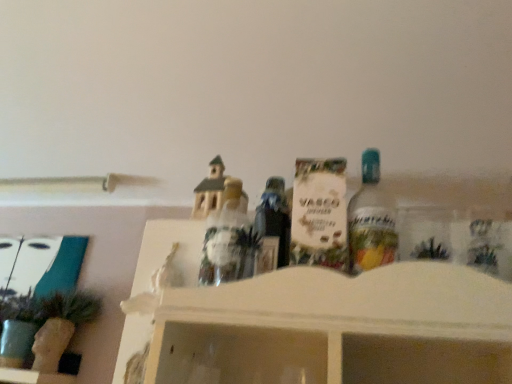
The image size is (512, 384). What do you see at coordinates (319, 214) in the screenshot?
I see `white matte box at center, placed as the third toy when sorted from left to right` at bounding box center [319, 214].

Identify the location of matte brown house at center, the second toy positioned from the left. (227, 239).

Identify the location of bottle on the right of matte brown house at center, the second toy positioned from the left. (371, 220).

Can you tell me how much clear glass bottle at center-right and matte brown house at center, the 2th toy positioned from the right, differ in facing direction?

A: They differ by 0.000237 degrees in their facing directions.

Which of these two, clear glass bottle at center-right or matte brown house at center, the second toy positioned from the left, stands taller?

With more height is clear glass bottle at center-right.

Which is correct: clear glass bottle at center-right is inside matte brown house at center, the 2th toy positioned from the right, or outside of it?

The correct answer is: outside.

Which is closer, (374, 160) or (132, 376)?

The point (374, 160) is more forward.

Considering the relative sizes of clear glass bottle at center-right and translucent plastic figurine at center, the first toy positioned from the left, in the image provided, is clear glass bottle at center-right bigger than translucent plastic figurine at center, the first toy positioned from the left,?

No.

From the image's perspective, is clear glass bottle at center-right below translucent plastic figurine at center, the third toy from the right?

Incorrect, from the image's perspective, clear glass bottle at center-right is higher than translucent plastic figurine at center, the third toy from the right.

Are clear glass bottle at center-right and translucent plastic figurine at center, the first toy positioned from the left, located far from each other?

clear glass bottle at center-right is actually quite close to translucent plastic figurine at center, the first toy positioned from the left.

The height and width of the screenshot is (384, 512). There is a translucent plastic figurine at center, the third toy from the right. What are the coordinates of `the 1st toy above it (from the image's perspective)` in the screenshot? It's located at (227, 239).

Considering the sizes of objects matte brown house at center, the second toy positioned from the left, and translucent plastic figurine at center, the first toy positioned from the left, in the image provided, who is smaller, matte brown house at center, the second toy positioned from the left, or translucent plastic figurine at center, the first toy positioned from the left,?

matte brown house at center, the second toy positioned from the left, is smaller.

Looking at this image, how much distance is there between matte brown house at center, the 2th toy positioned from the right, and translucent plastic figurine at center, the first toy positioned from the left?

A distance of 11.46 centimeters exists between matte brown house at center, the 2th toy positioned from the right, and translucent plastic figurine at center, the first toy positioned from the left.

Which is in front, point (213, 265) or point (135, 373)?

Positioned in front is point (213, 265).

From the picture: Is the surface of translucent plastic figurine at center, the first toy positioned from the left, in direct contact with white matte box at center, placed as the third toy when sorted from left to right?

No, translucent plastic figurine at center, the first toy positioned from the left, is not making contact with white matte box at center, placed as the third toy when sorted from left to right.

Considering the relative positions of translucent plastic figurine at center, the first toy positioned from the left, and white matte box at center, placed as the third toy when sorted from left to right, in the image provided, is translucent plastic figurine at center, the first toy positioned from the left, to the left of white matte box at center, placed as the third toy when sorted from left to right, from the viewer's perspective?

Indeed, translucent plastic figurine at center, the first toy positioned from the left, is positioned on the left side of white matte box at center, placed as the third toy when sorted from left to right.

Is translucent plastic figurine at center, the first toy positioned from the left, in front of white matte box at center, arranged as the first toy when viewed from the right?

No, it is not.

From a real-world perspective, is translucent plastic figurine at center, the first toy positioned from the left, on matte brown house at center, the second toy positioned from the left?

Actually, translucent plastic figurine at center, the first toy positioned from the left, is physically below matte brown house at center, the second toy positioned from the left, in the real world.

Does translucent plastic figurine at center, the third toy from the right, have a lesser width compared to matte brown house at center, the 2th toy positioned from the right?

Correct, the width of translucent plastic figurine at center, the third toy from the right, is less than that of matte brown house at center, the 2th toy positioned from the right.

Does translucent plastic figurine at center, the third toy from the right, come in front of matte brown house at center, the second toy positioned from the left?

Yes, the depth of translucent plastic figurine at center, the third toy from the right, is less than that of matte brown house at center, the second toy positioned from the left.

In the scene shown: From the image's perspective, relative to matte brown house at center, the second toy positioned from the left, is translucent plastic figurine at center, the first toy positioned from the left, above or below?

translucent plastic figurine at center, the first toy positioned from the left, is below matte brown house at center, the second toy positioned from the left.

Considering the sizes of white matte box at center, arranged as the first toy when viewed from the right, and translucent plastic figurine at center, the first toy positioned from the left, in the image, is white matte box at center, arranged as the first toy when viewed from the right, wider or thinner than translucent plastic figurine at center, the first toy positioned from the left,?

Considering their sizes, white matte box at center, arranged as the first toy when viewed from the right, looks broader than translucent plastic figurine at center, the first toy positioned from the left.

From a real-world perspective, is white matte box at center, arranged as the first toy when viewed from the right, positioned under translucent plastic figurine at center, the first toy positioned from the left, based on gravity?

Actually, white matte box at center, arranged as the first toy when viewed from the right, is physically above translucent plastic figurine at center, the first toy positioned from the left, in the real world.

Is white matte box at center, placed as the third toy when sorted from left to right, at the right side of translucent plastic figurine at center, the first toy positioned from the left?

Indeed, white matte box at center, placed as the third toy when sorted from left to right, is positioned on the right side of translucent plastic figurine at center, the first toy positioned from the left.

Are white matte box at center, arranged as the first toy when viewed from the right, and clear glass bottle at center-right making contact?

Absolutely, white matte box at center, arranged as the first toy when viewed from the right, is next to and touching clear glass bottle at center-right.

Which object is positioned more to the right, white matte box at center, placed as the third toy when sorted from left to right, or clear glass bottle at center-right?

From the viewer's perspective, clear glass bottle at center-right appears more on the right side.

Which point is more distant from viewer, [330,185] or [355,248]?

The point [330,185] is behind.

Where is `the 3rd toy behind when counting from the clear glass bottle at center-right`? This screenshot has height=384, width=512. the 3rd toy behind when counting from the clear glass bottle at center-right is located at coordinates (227, 239).

Image resolution: width=512 pixels, height=384 pixels. I want to click on the 3rd toy below the clear glass bottle at center-right (from the image's perspective), so click(x=149, y=312).

From the picture: Which object lies further to the anchor point clear glass bottle at center-right, matte brown house at center, the 2th toy positioned from the right, or white matte box at center, placed as the third toy when sorted from left to right?

matte brown house at center, the 2th toy positioned from the right, is further to clear glass bottle at center-right.

Considering their positions, is white matte box at center, placed as the third toy when sorted from left to right, positioned closer to matte brown house at center, the 2th toy positioned from the right, than clear glass bottle at center-right?

Among the two, white matte box at center, placed as the third toy when sorted from left to right, is located nearer to matte brown house at center, the 2th toy positioned from the right.

Looking at the image, which one is located closer to matte brown house at center, the 2th toy positioned from the right, clear glass bottle at center-right or translucent plastic figurine at center, the first toy positioned from the left?

Based on the image, translucent plastic figurine at center, the first toy positioned from the left, appears to be nearer to matte brown house at center, the 2th toy positioned from the right.

Estimate the real-world distances between objects in this image. Which object is closer to translucent plastic figurine at center, the third toy from the right, clear glass bottle at center-right or white matte box at center, arranged as the first toy when viewed from the right?

white matte box at center, arranged as the first toy when viewed from the right, is positioned closer to the anchor translucent plastic figurine at center, the third toy from the right.

From the image, which object appears to be farther from white matte box at center, arranged as the first toy when viewed from the right, clear glass bottle at center-right or translucent plastic figurine at center, the first toy positioned from the left?

Among the two, translucent plastic figurine at center, the first toy positioned from the left, is located further to white matte box at center, arranged as the first toy when viewed from the right.

When comparing their distances from translucent plastic figurine at center, the first toy positioned from the left, does matte brown house at center, the second toy positioned from the left, or white matte box at center, arranged as the first toy when viewed from the right, seem further?

white matte box at center, arranged as the first toy when viewed from the right.

When comparing their distances from matte brown house at center, the 2th toy positioned from the right, does clear glass bottle at center-right or white matte box at center, arranged as the first toy when viewed from the right, seem closer?

Among the two, white matte box at center, arranged as the first toy when viewed from the right, is located nearer to matte brown house at center, the 2th toy positioned from the right.

Considering their positions, is white matte box at center, placed as the third toy when sorted from left to right, positioned closer to translucent plastic figurine at center, the first toy positioned from the left, than matte brown house at center, the 2th toy positioned from the right?

matte brown house at center, the 2th toy positioned from the right, is positioned closer to the anchor translucent plastic figurine at center, the first toy positioned from the left.

The height and width of the screenshot is (384, 512). Identify the location of toy between matte brown house at center, the second toy positioned from the left, and clear glass bottle at center-right from left to right. (319, 214).

This screenshot has width=512, height=384. What are the coordinates of `toy located between translucent plastic figurine at center, the third toy from the right, and white matte box at center, placed as the third toy when sorted from left to right, in the left-right direction` in the screenshot? It's located at (227, 239).